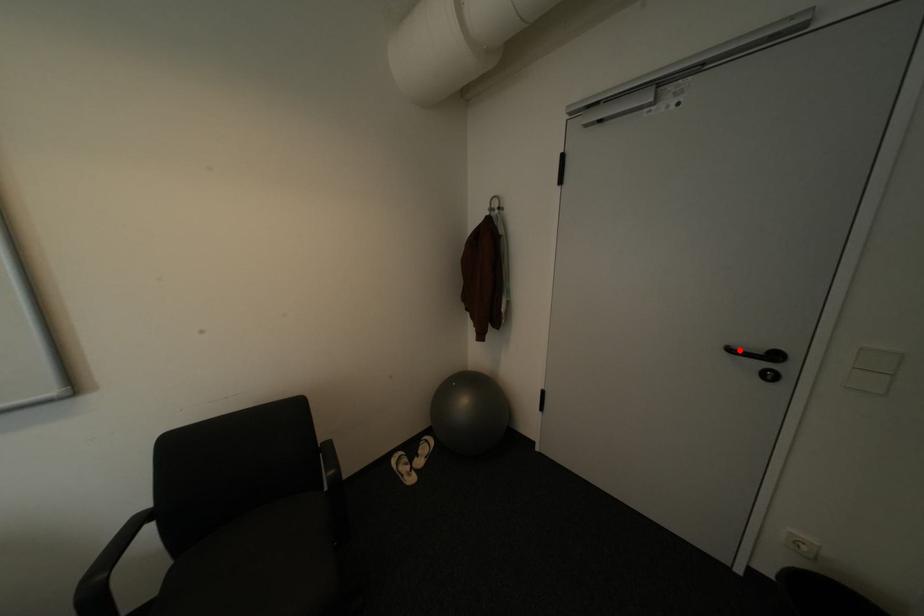
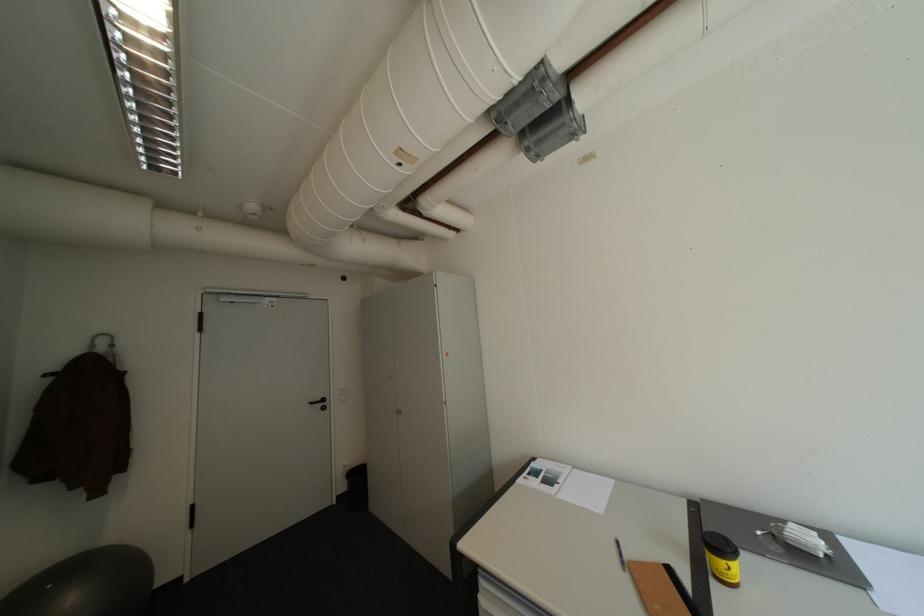
Find the pixel in the second image that matches the highlighted location in the first image.

(321, 403)